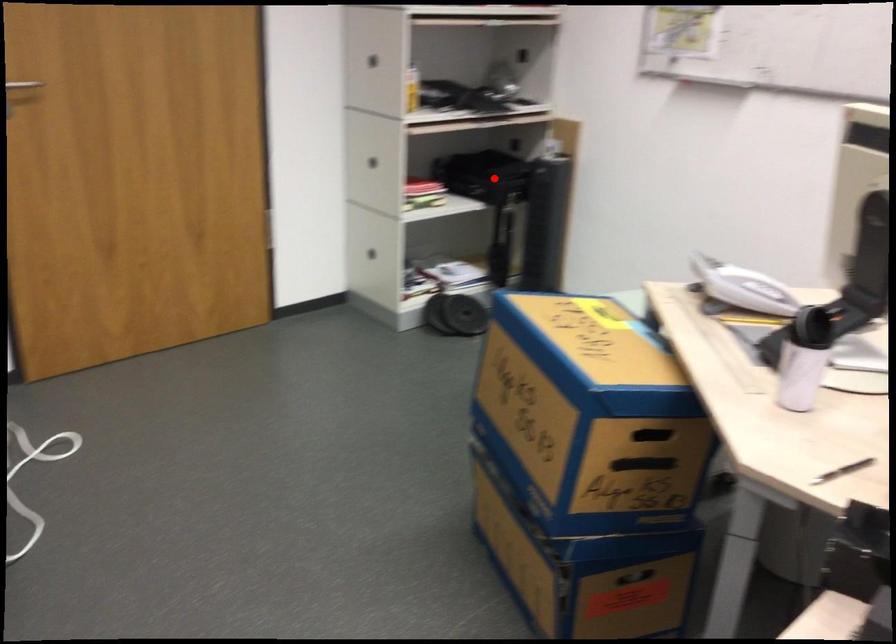
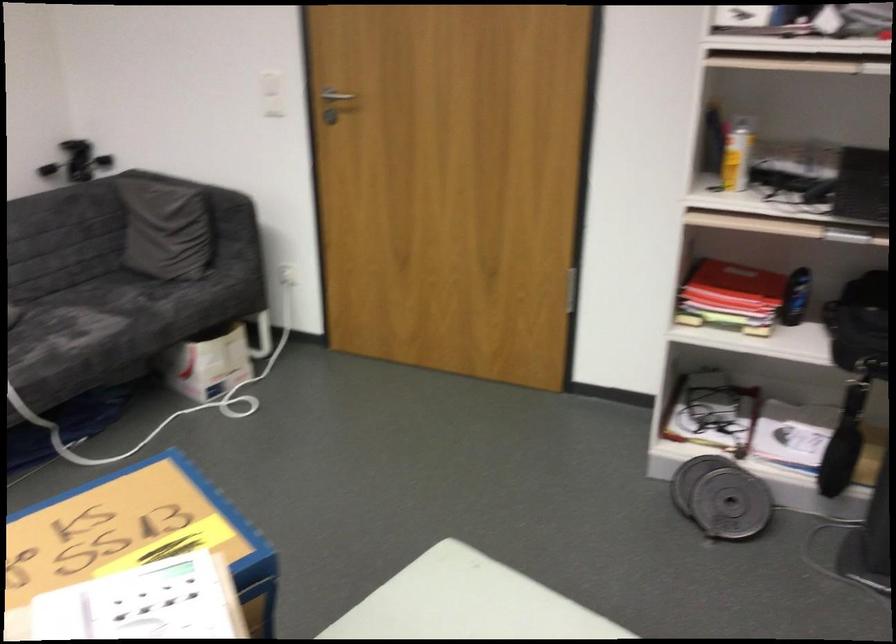
Question: A red point is marked in image1. In image2, is the corresponding 3D point closer to the camera or farther? Reply with the corresponding letter.

Choices:
 (A) The corresponding 3D point is closer.
 (B) The corresponding 3D point is farther.

Answer: (A)